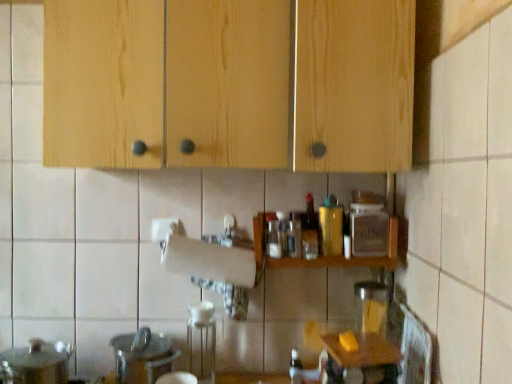
Question: Looking at their shapes, would you say natural wood cabinets at upper center is wider or thinner than white matte paper towel at center?

Choices:
 (A) thin
 (B) wide

Answer: (B)

Question: Is natural wood cabinets at upper center bigger or smaller than white matte paper towel at center?

Choices:
 (A) small
 (B) big

Answer: (B)

Question: Which of these objects is positioned farthest from the translucent glass bottle at lower center, which is counted as the first bottle, starting from the bottom?

Choices:
 (A) gold metallic canister at center, the 2th bottle ordered from the bottom
 (B) wooden table at lower right
 (C) white matte paper towel at center
 (D) wooden spice rack at center
 (E) white glossy sink at lower left

Answer: (E)

Question: Estimate the real-world distances between objects in this image. Which object is closer to the wooden spice rack at center?

Choices:
 (A) natural wood cabinets at upper center
 (B) wooden table at lower right
 (C) translucent plastic bottle at center, which ranks as the first bottle in top-to-bottom order
 (D) white glossy sink at lower left
 (E) white matte paper towel at center

Answer: (C)